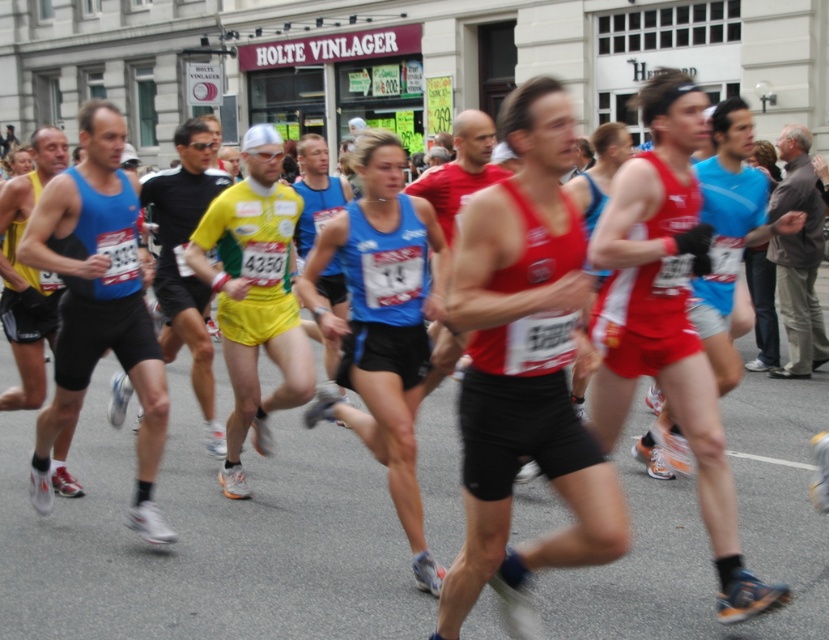
Who is more forward, (100, 221) or (194, 324)?

Point (100, 221)

Is matte blue tank top at left taller than yellow fabric shorts at left?

Incorrect, matte blue tank top at left's height is not larger of yellow fabric shorts at left's.

Does point (46, 264) come in front of point (200, 156)?

Yes, point (46, 264) is closer to viewer.

Find the location of a particular element. The height and width of the screenshot is (640, 829). matte blue tank top at left is located at coordinates point(98,305).

Can you confirm if red matte shorts at center is smaller than brown textured shirt at right?

Indeed, red matte shorts at center has a smaller size compared to brown textured shirt at right.

Who is taller, red matte shorts at center or brown textured shirt at right?

Standing taller between the two is brown textured shirt at right.

Which is behind, point (723, 177) or point (791, 372)?

The point (791, 372) is behind.

At what (x,y) coordinates should I click in order to perform the action: click on red matte shorts at center. Please return your answer as a coordinate pair (x, y). Looking at the image, I should click on (730, 230).

Does matte red tank top at center appear under matte blue tank top at left?

No, matte red tank top at center is not below matte blue tank top at left.

Is matte red tank top at center wider than matte blue tank top at left?

In fact, matte red tank top at center might be narrower than matte blue tank top at left.

From the picture: Who is more distant from viewer, (550,401) or (81,298)?

Point (81,298)

At what (x,y) coordinates should I click in order to perform the action: click on matte red tank top at center. Please return your answer as a coordinate pair (x, y). The height and width of the screenshot is (640, 829). Looking at the image, I should click on (522, 365).